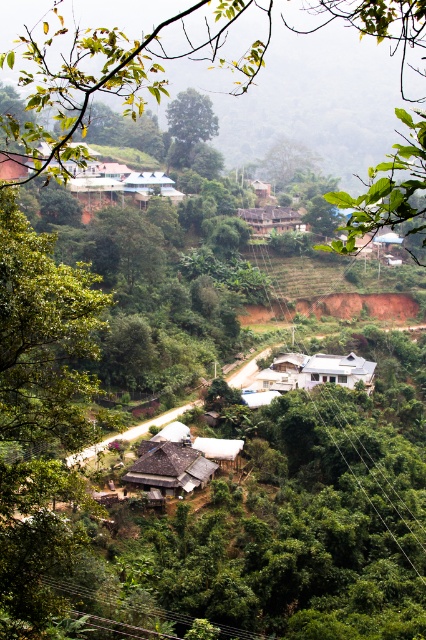
Does green leafy tree at upper center appear on the right side of white corrugated metal hut at center?

Incorrect, green leafy tree at upper center is not on the right side of white corrugated metal hut at center.

Who is lower down, green leafy tree at upper center or white corrugated metal hut at center?

Positioned lower is white corrugated metal hut at center.

Which is behind, point (54, 154) or point (215, 449)?

Positioned behind is point (215, 449).

You are a GUI agent. You are given a task and a screenshot of the screen. Output one action in this format:
    pyautogui.click(x=<x>, y=<y>)
    Task: Click on the green leafy tree at upper center
    
    Given the screenshot: What is the action you would take?
    pyautogui.click(x=126, y=60)

Is point (293, 214) positioned in front of point (210, 451)?

No, (293, 214) is further to viewer.

Which of these two, brown wooden hut at upper center or white corrugated metal hut at center, stands taller?

With more height is brown wooden hut at upper center.

The image size is (426, 640). What do you see at coordinates (271, 220) in the screenshot?
I see `brown wooden hut at upper center` at bounding box center [271, 220].

This screenshot has width=426, height=640. Identify the location of brown wooden hut at upper center. (271, 220).

Can you confirm if green leafy tree at upper center is positioned to the right of brown wooden hut at upper center?

In fact, green leafy tree at upper center is to the left of brown wooden hut at upper center.

The width and height of the screenshot is (426, 640). I want to click on green leafy tree at upper center, so click(x=126, y=60).

Between point (360, 228) and point (256, 211), which one is positioned behind?

Positioned behind is point (256, 211).

Find the location of a particular element. The width and height of the screenshot is (426, 640). green leafy tree at upper center is located at coordinates (126, 60).